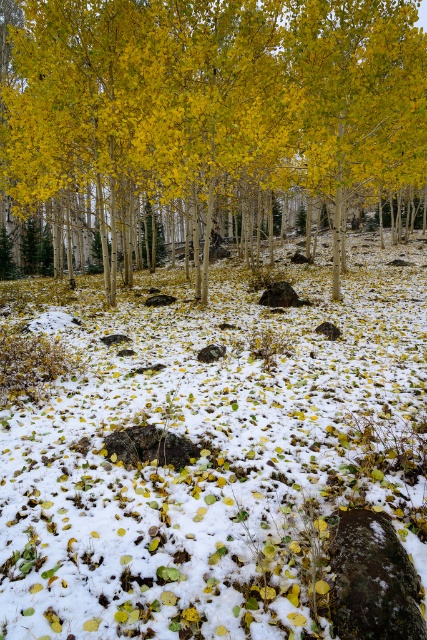
Is white fluffy snow at center wider than yellow matte tree at center?

No, white fluffy snow at center is not wider than yellow matte tree at center.

This screenshot has height=640, width=427. What do you see at coordinates (211, 454) in the screenshot?
I see `white fluffy snow at center` at bounding box center [211, 454].

Who is more forward, (318, 557) or (403, 1)?

Point (318, 557)

I want to click on white fluffy snow at center, so click(x=211, y=454).